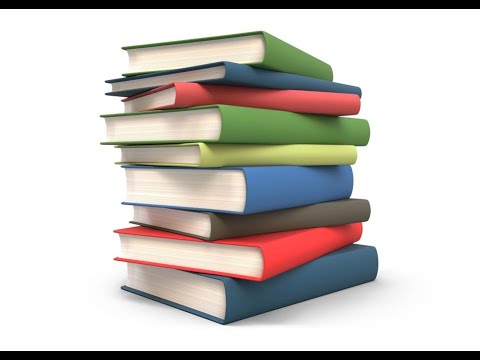
Locate an element on the screen. book spine is located at coordinates (317, 285), (288, 256), (316, 215), (277, 194), (298, 159), (277, 120), (297, 107), (282, 81), (294, 57).